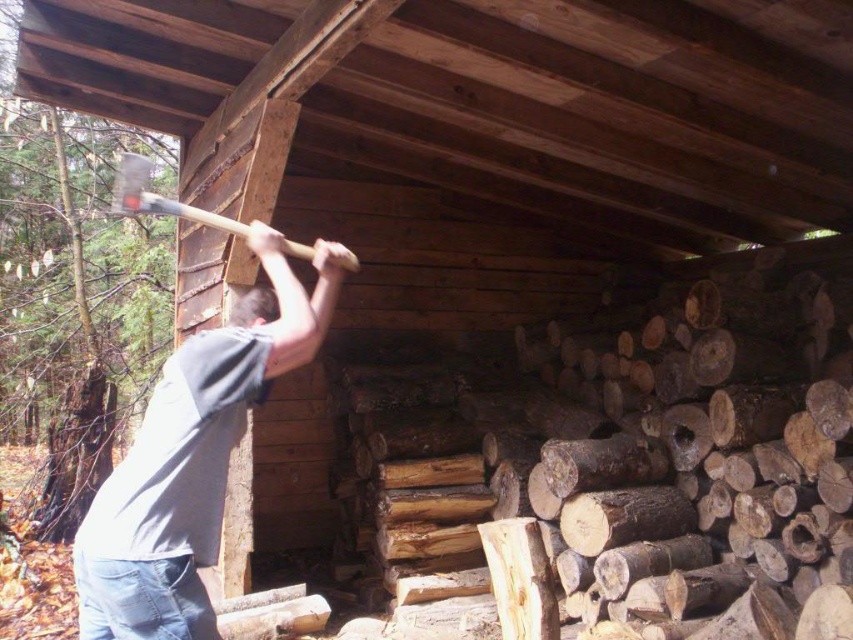
Question: Which object is positioned closest to the gray cotton shirt at upper left?

Choices:
 (A) matte wooden hammer at upper center
 (B) dark brown hair at upper center

Answer: (B)

Question: Does gray cotton shirt at upper left appear under dark brown hair at upper center?

Choices:
 (A) no
 (B) yes

Answer: (B)

Question: Which object appears farthest from the camera in this image?

Choices:
 (A) gray cotton shirt at upper left
 (B) matte wooden hammer at upper center
 (C) dark brown hair at upper center

Answer: (B)

Question: Does gray cotton shirt at upper left lie behind dark brown hair at upper center?

Choices:
 (A) no
 (B) yes

Answer: (A)

Question: Which point is farther to the camera?

Choices:
 (A) dark brown hair at upper center
 (B) matte wooden hammer at upper center
 (C) gray cotton shirt at upper left

Answer: (B)

Question: Does gray cotton shirt at upper left have a greater width compared to dark brown hair at upper center?

Choices:
 (A) yes
 (B) no

Answer: (A)